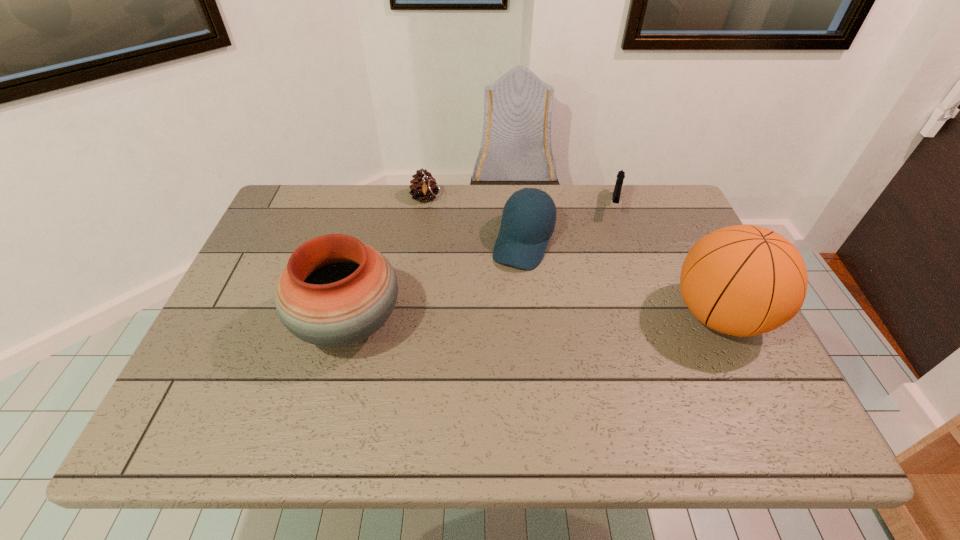
The width and height of the screenshot is (960, 540). Find the location of `free region located 0.170m on the front-facing side of the third object from right to left`. free region located 0.170m on the front-facing side of the third object from right to left is located at coordinates (495, 318).

You are a GUI agent. You are given a task and a screenshot of the screen. Output one action in this format:
    pyautogui.click(x=<x>, y=<y>)
    Task: Click on the free space located with a leaf charm attached to the pinecone
    
    Given the screenshot: What is the action you would take?
    pyautogui.click(x=464, y=282)

You are a GUI agent. You are given a task and a screenshot of the screen. Output one action in this format:
    pyautogui.click(x=<x>, y=<y>)
    Task: Click on the free space located 0.210m with a leaf charm attached to the pinecone
    
    Given the screenshot: What is the action you would take?
    pyautogui.click(x=449, y=251)

Identify the location of vacant space located with a leaf charm attached to the pinecone. This screenshot has height=540, width=960. click(x=451, y=255).

Where is `blank space located 0.290m on the front-facing side of the pistol`? blank space located 0.290m on the front-facing side of the pistol is located at coordinates (603, 290).

You are a GUI agent. You are given a task and a screenshot of the screen. Output one action in this format:
    pyautogui.click(x=<x>, y=<y>)
    Task: Click on the vacant area situated 0.310m on the front-facing side of the pistol
    This screenshot has height=540, width=960.
    Given the screenshot: What is the action you would take?
    pyautogui.click(x=602, y=295)

The width and height of the screenshot is (960, 540). I want to click on vacant position located on the front-facing side of the pistol, so click(609, 259).

Identify the location of baseball cap that is at the far edge. The height and width of the screenshot is (540, 960). (524, 234).

Where is `pinecone present at the far edge`? pinecone present at the far edge is located at coordinates (423, 187).

Locate an element on the screen. pistol located in the far edge section of the desktop is located at coordinates click(621, 174).